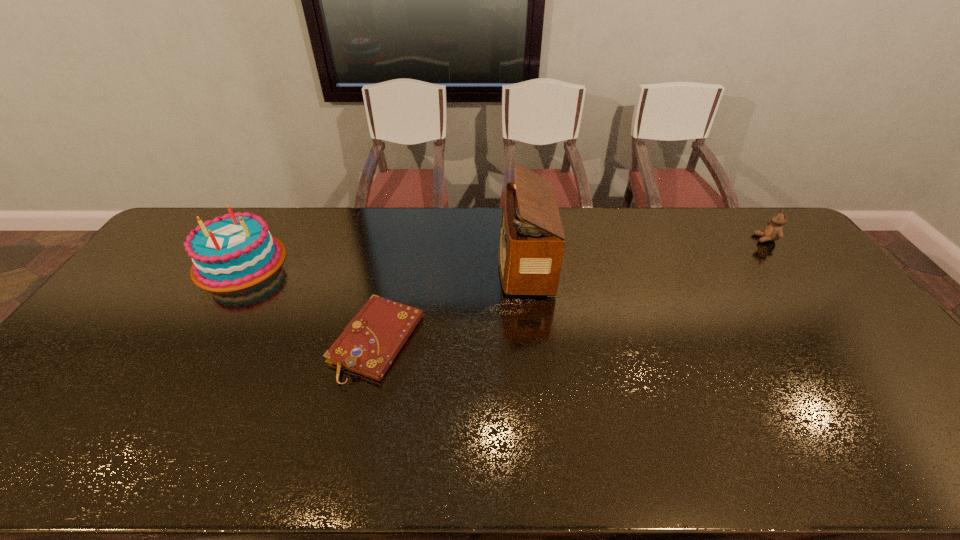
Find the location of a particular element. object located in the right edge section of the desktop is located at coordinates (774, 231).

Identify the location of object situated at the far left corner. (236, 251).

Identify the location of object present at the far right corner. pos(774,231).

Image resolution: width=960 pixels, height=540 pixels. In the image, there is a desktop. Find the location of `vacant space at the far edge`. vacant space at the far edge is located at coordinates (254, 210).

You are a GUI agent. You are given a task and a screenshot of the screen. Output one action in this format:
    pyautogui.click(x=<x>, y=<y>)
    Task: Click on the vacant region at the near edge of the desktop
    The width and height of the screenshot is (960, 540).
    Given the screenshot: What is the action you would take?
    pyautogui.click(x=207, y=460)

This screenshot has height=540, width=960. In order to click on vacant space at the left edge of the desktop in this screenshot , I will do `click(122, 363)`.

In the image, there is a desktop. Where is `free space at the right edge`? The image size is (960, 540). free space at the right edge is located at coordinates tap(785, 265).

I want to click on free region at the far left corner, so click(207, 219).

In the image, there is a desktop. Identify the location of free space at the far right corner. Image resolution: width=960 pixels, height=540 pixels. (758, 240).

The image size is (960, 540). I want to click on vacant point located between the shortest object and the teddy bear, so click(571, 290).